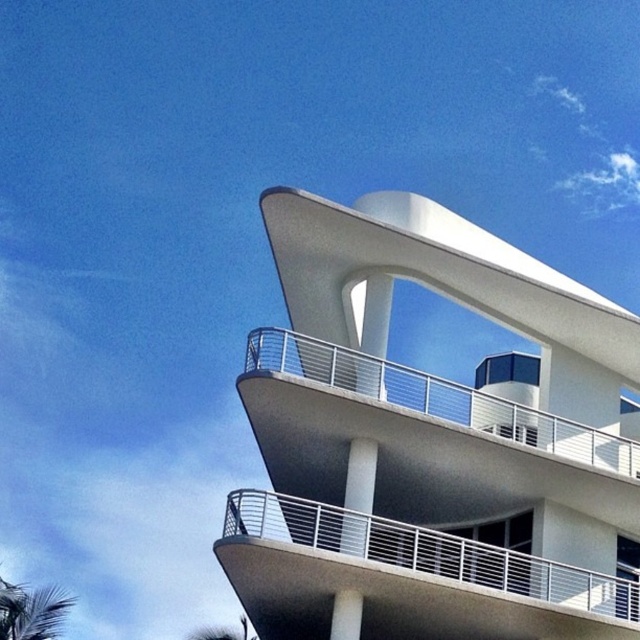
Question: Is white smooth balcony at upper right below white metal railing at center?

Choices:
 (A) yes
 (B) no

Answer: (B)

Question: Which point is closer to the camera?

Choices:
 (A) white smooth balcony at upper right
 (B) white metal railing at center

Answer: (B)

Question: Does white smooth balcony at upper right have a smaller size compared to white metal railing at center?

Choices:
 (A) yes
 (B) no

Answer: (B)

Question: Which object appears farthest from the camera in this image?

Choices:
 (A) white metal railing at center
 (B) white smooth balcony at upper right

Answer: (B)

Question: Is white smooth balcony at upper right above white metal railing at center?

Choices:
 (A) yes
 (B) no

Answer: (A)